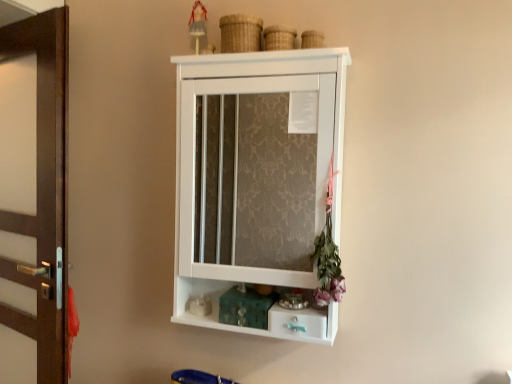
I want to click on purple fabric flower at right, so click(x=328, y=255).

This screenshot has height=384, width=512. What do you see at coordinates (33, 199) in the screenshot? I see `brown wood door at left` at bounding box center [33, 199].

Identify the location of white matte figurine at lower center, the first toy positioned from the bottom. (199, 305).

Is point (324, 335) farther from camera compared to point (334, 263)?

No, (324, 335) is in front of (334, 263).

Which object is wider, teal glossy drawer at lower center or purple fabric flower at right?

teal glossy drawer at lower center is wider.

Does teal glossy drawer at lower center have a larger size compared to purple fabric flower at right?

No.

How distant is teal glossy drawer at lower center from purple fabric flower at right?

A distance of 5.85 inches exists between teal glossy drawer at lower center and purple fabric flower at right.

Find the location of `cupboard located on the right of white matte figurine at lower center, placed as the 2th toy when sorted from top to bottom`. cupboard located on the right of white matte figurine at lower center, placed as the 2th toy when sorted from top to bottom is located at coordinates (256, 174).

Which object is further away from the camera taking this photo, white matte cabinet at center or white matte figurine at lower center, the first toy positioned from the bottom?

Positioned behind is white matte figurine at lower center, the first toy positioned from the bottom.

Does point (268, 66) appear closer or farther from the camera than point (196, 312)?

Point (268, 66).

From the image's perspective, between white matte cabinet at center and white matte figurine at lower center, placed as the 2th toy when sorted from top to bottom, which one is located above?

white matte cabinet at center appears higher in the image.

What's the angular difference between teal glossy drawer at lower center and matte plastic doll at upper center, acting as the first toy starting from the top,'s facing directions?

The angle between the facing direction of teal glossy drawer at lower center and the facing direction of matte plastic doll at upper center, acting as the first toy starting from the top, is 1.18 degrees.

Who is more distant, teal glossy drawer at lower center or matte plastic doll at upper center, the second toy when ordered from bottom to top?

matte plastic doll at upper center, the second toy when ordered from bottom to top, is behind.

Is teal glossy drawer at lower center oriented away from matte plastic doll at upper center, the second toy when ordered from bottom to top?

No, teal glossy drawer at lower center is not facing away from matte plastic doll at upper center, the second toy when ordered from bottom to top.

Identify the location of door on the left of white matte figurine at lower center, placed as the 2th toy when sorted from top to bottom. This screenshot has height=384, width=512. (33, 199).

Is white matte figurine at lower center, placed as the 2th toy when sorted from top to bottom, wider than brown wood door at left?

Indeed, white matte figurine at lower center, placed as the 2th toy when sorted from top to bottom, has a greater width compared to brown wood door at left.

Is white matte figurine at lower center, the first toy positioned from the bottom, aimed at brown wood door at left?

No, white matte figurine at lower center, the first toy positioned from the bottom, is not oriented towards brown wood door at left.

Image resolution: width=512 pixels, height=384 pixels. Identify the location of flower in front of the white matte figurine at lower center, the first toy positioned from the bottom. coord(328,255).

From the image's perspective, is purple fabric flower at right located beneath white matte figurine at lower center, placed as the 2th toy when sorted from top to bottom?

No.

Between point (329, 283) and point (199, 301), which one is positioned in front?

The point (329, 283) is closer to the camera.

Is purple fabric flower at right facing away from white matte figurine at lower center, placed as the 2th toy when sorted from top to bottom?

No, purple fabric flower at right's orientation is not away from white matte figurine at lower center, placed as the 2th toy when sorted from top to bottom.

In the image, is white matte figurine at lower center, the first toy positioned from the bottom, on the left side or the right side of teal glossy drawer at lower center?

Clearly, white matte figurine at lower center, the first toy positioned from the bottom, is on the left of teal glossy drawer at lower center in the image.

Could you tell me if white matte figurine at lower center, the first toy positioned from the bottom, is turned towards teal glossy drawer at lower center?

No, white matte figurine at lower center, the first toy positioned from the bottom, is not aimed at teal glossy drawer at lower center.

In the image, there is a teal glossy drawer at lower center. Find the location of `toy below it (from a real-world perspective)`. toy below it (from a real-world perspective) is located at coordinates (199, 305).

Considering their positions, is white matte figurine at lower center, the first toy positioned from the bottom, located in front of or behind teal glossy drawer at lower center?

In the image, white matte figurine at lower center, the first toy positioned from the bottom, appears behind teal glossy drawer at lower center.

From the image's perspective, who appears lower, brown wood door at left or white matte cabinet at center?

brown wood door at left is shown below in the image.

Is brown wood door at left not within white matte cabinet at center?

Yes.

Is the surface of brown wood door at left in direct contact with white matte cabinet at center?

brown wood door at left is not next to white matte cabinet at center, and they're not touching.

Considering their positions, is brown wood door at left located in front of or behind white matte cabinet at center?

brown wood door at left is positioned farther from the viewer than white matte cabinet at center.

Find the location of a particular element. The width and height of the screenshot is (512, 384). flower in front of the teal glossy drawer at lower center is located at coordinates (328, 255).

In the image, there is a white matte cabinet at center. Where is `toy below it (from the image's perspective)`? toy below it (from the image's perspective) is located at coordinates (199, 305).

Looking at the image, which one is located closer to teal glossy drawer at lower center, white matte figurine at lower center, placed as the 2th toy when sorted from top to bottom, or purple fabric flower at right?

Based on the image, purple fabric flower at right appears to be nearer to teal glossy drawer at lower center.

Looking at the image, which one is located closer to white matte figurine at lower center, the first toy positioned from the bottom, white matte cabinet at center or brown wood door at left?

brown wood door at left lies closer to white matte figurine at lower center, the first toy positioned from the bottom, than the other object.

When comparing their distances from white matte cabinet at center, does brown wood door at left or matte plastic doll at upper center, the second toy when ordered from bottom to top, seem closer?

The object closer to white matte cabinet at center is brown wood door at left.

Estimate the real-world distances between objects in this image. Which object is further from brown wood door at left, teal glossy drawer at lower center or matte plastic doll at upper center, acting as the first toy starting from the top?

teal glossy drawer at lower center lies further to brown wood door at left than the other object.

When comparing their distances from matte plastic doll at upper center, the second toy when ordered from bottom to top, does white matte cabinet at center or brown wood door at left seem further?

Based on the image, white matte cabinet at center appears to be further to matte plastic doll at upper center, the second toy when ordered from bottom to top.

From the image, which object appears to be farther from matte plastic doll at upper center, acting as the first toy starting from the top, brown wood door at left or teal glossy drawer at lower center?

teal glossy drawer at lower center lies further to matte plastic doll at upper center, acting as the first toy starting from the top, than the other object.

When comparing their distances from purple fabric flower at right, does white matte figurine at lower center, placed as the 2th toy when sorted from top to bottom, or brown wood door at left seem closer?

white matte figurine at lower center, placed as the 2th toy when sorted from top to bottom, lies closer to purple fabric flower at right than the other object.

From the image, which object appears to be nearer to teal glossy drawer at lower center, matte plastic doll at upper center, the second toy when ordered from bottom to top, or brown wood door at left?

brown wood door at left is closer to teal glossy drawer at lower center.

The height and width of the screenshot is (384, 512). I want to click on cupboard between white matte figurine at lower center, the first toy positioned from the bottom, and purple fabric flower at right, so click(256, 174).

The height and width of the screenshot is (384, 512). Find the location of `cupboard between matte plastic doll at upper center, acting as the first toy starting from the top, and purple fabric flower at right from top to bottom`. cupboard between matte plastic doll at upper center, acting as the first toy starting from the top, and purple fabric flower at right from top to bottom is located at coordinates (256, 174).

Locate an element on the screen. flower between white matte cabinet at center and teal glossy drawer at lower center vertically is located at coordinates (328, 255).

At what (x,y) coordinates should I click in order to perform the action: click on drawer between white matte figurine at lower center, placed as the 2th toy when sorted from top to bottom, and purple fabric flower at right, in the horizontal direction. Please return your answer as a coordinate pair (x, y). The image size is (512, 384). Looking at the image, I should click on (298, 321).